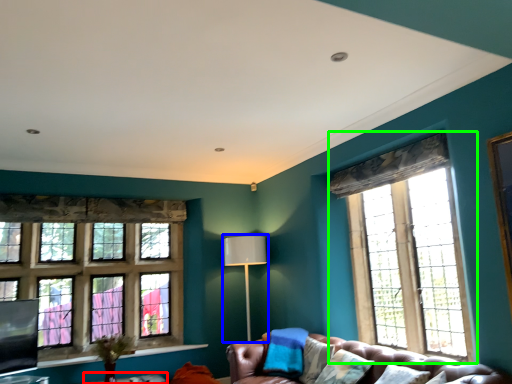
Question: Which object is the farthest from table (highlighted by a red box)? Choose among these: lamp (highlighted by a blue box) or window (highlighted by a green box).

Choices:
 (A) lamp
 (B) window

Answer: (B)